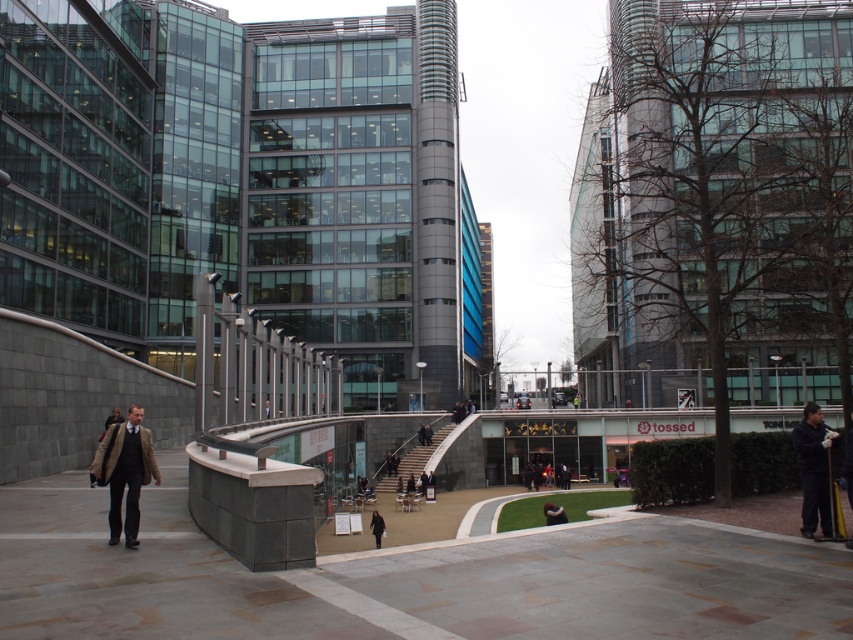
Question: Considering the real-world distances, which object is closest to the dark gray coat at center?

Choices:
 (A) light brown leather jacket at lower left
 (B) white matte jacket at center
 (C) dark gray jacket at lower right

Answer: (B)

Question: Does brown wool coat at center appear over white matte jacket at center?

Choices:
 (A) no
 (B) yes

Answer: (B)

Question: Based on their relative distances, which object is nearer to the brown wool coat at center?

Choices:
 (A) dark gray coat at center
 (B) dark gray jacket at lower right
 (C) white matte jacket at center
 (D) light brown leather jacket at lower left

Answer: (B)

Question: Can you confirm if brown wool coat at center is wider than dark gray jacket at lower right?

Choices:
 (A) yes
 (B) no

Answer: (B)

Question: Which point is farther from the camera taking this photo?

Choices:
 (A) (808, 468)
 (B) (119, 410)
 (C) (111, 458)

Answer: (B)

Question: Can you confirm if white matte jacket at center is positioned to the right of light brown leather jacket at lower left?

Choices:
 (A) no
 (B) yes

Answer: (B)